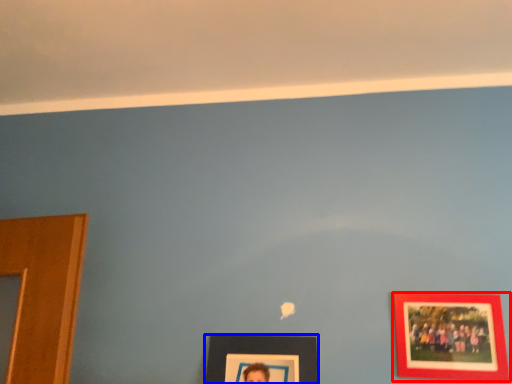
Question: Which point is closer to the camera, picture frame (highlighted by a red box) or picture frame (highlighted by a blue box)?

Choices:
 (A) picture frame
 (B) picture frame

Answer: (B)